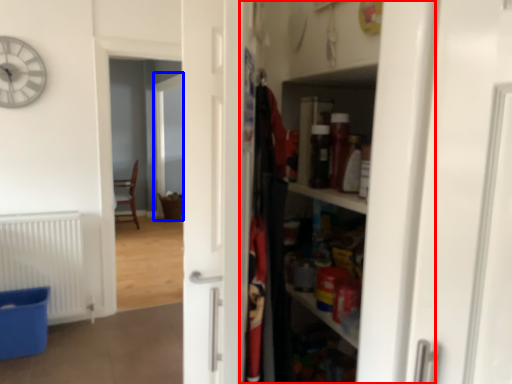
Question: Which object appears farthest to the camera in this image, dresser (highlighted by a red box) or screen door (highlighted by a blue box)?

Choices:
 (A) dresser
 (B) screen door

Answer: (B)